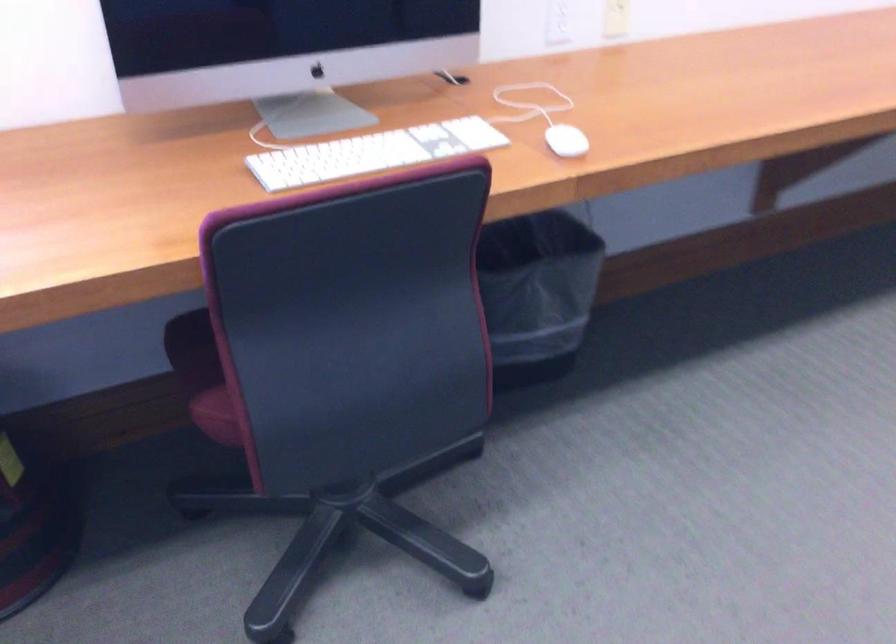
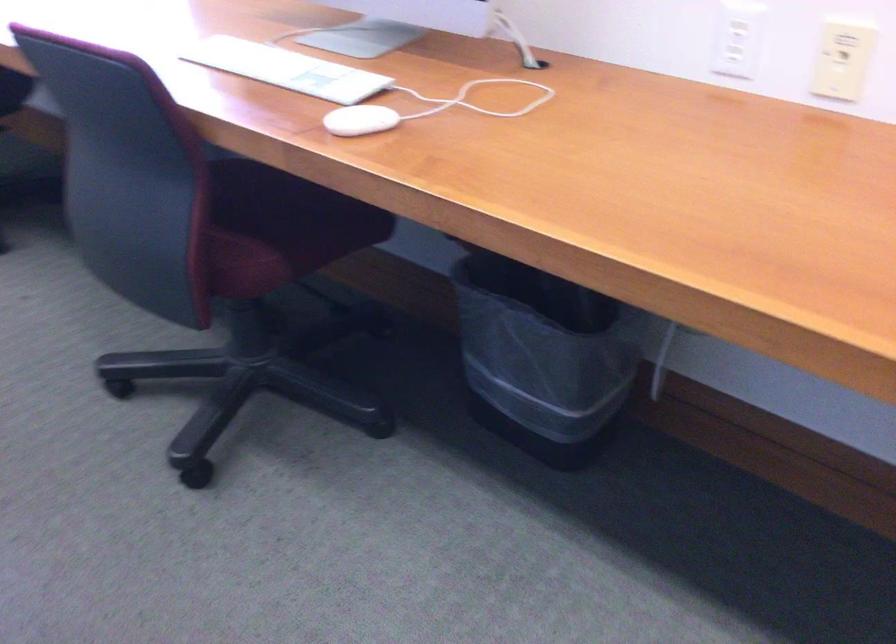
The point at (573, 136) is marked in the first image. Where is the corresponding point in the second image?

(359, 120)